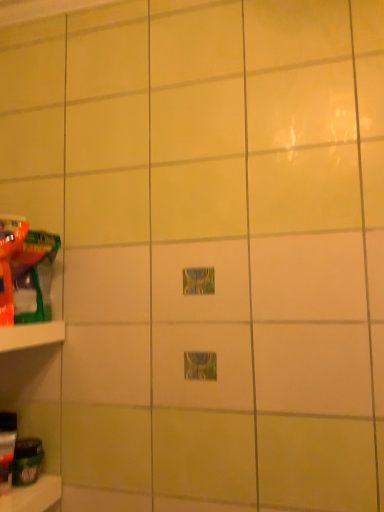
Question: Considering the positions of white plastic shelf at left and translucent plastic toy at left, the first toy in the top-to-bottom sequence, in the image, is white plastic shelf at left bigger or smaller than translucent plastic toy at left, the first toy in the top-to-bottom sequence,?

Choices:
 (A) big
 (B) small

Answer: (B)

Question: Is point (59, 333) closer or farther from the camera than point (18, 239)?

Choices:
 (A) closer
 (B) farther

Answer: (B)

Question: Which object is positioned farthest from the translucent plastic toy at left, the first toy in the top-to-bottom sequence?

Choices:
 (A) translucent plastic bottle at lower left, positioned as the 3th toy in top-to-bottom order
 (B) green matte jar at lower left, which is counted as the first toy, starting from the bottom
 (C) white plastic shelf at left
 (D) matte plastic toy at left, which is the third toy from bottom to top

Answer: (B)

Question: Estimate the real-world distances between objects in this image. Which object is closer to the translucent plastic bottle at lower left, positioned as the 3th toy in top-to-bottom order?

Choices:
 (A) white plastic shelf at left
 (B) translucent plastic toy at left, the first toy in the top-to-bottom sequence
 (C) matte plastic toy at left, which is the third toy from bottom to top
 (D) green matte jar at lower left, which is counted as the first toy, starting from the bottom

Answer: (D)